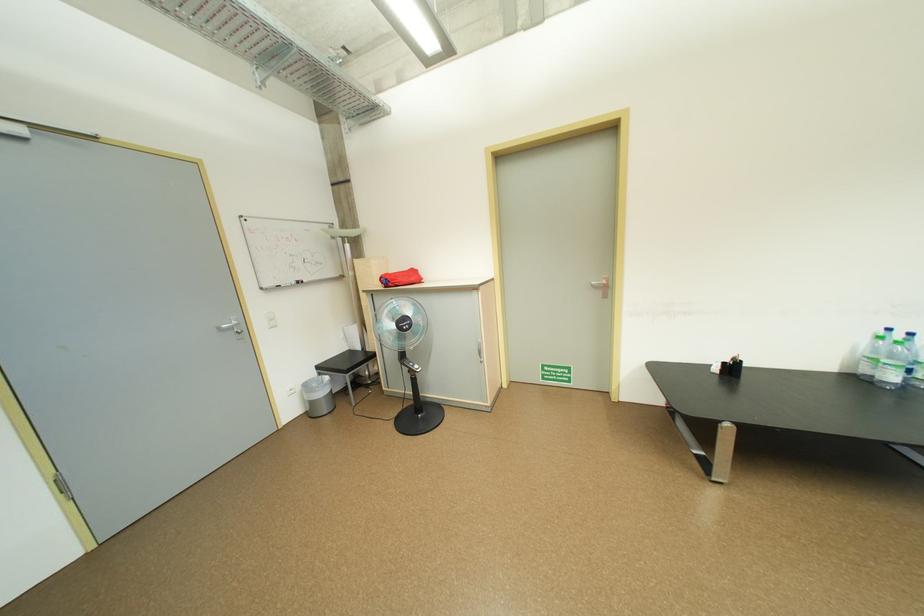
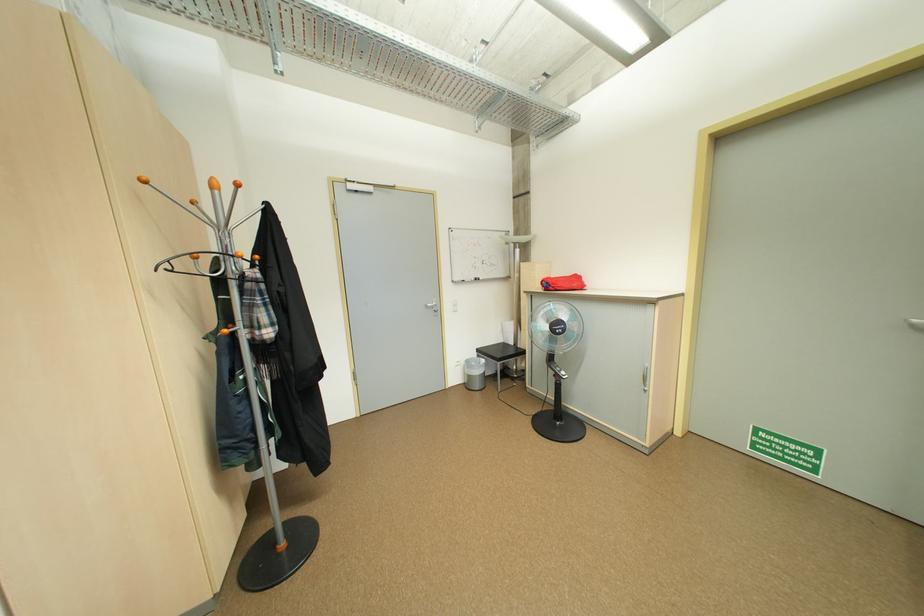
Locate, in the second image, the point that corresponds to point (322, 374) in the first image.

(483, 355)